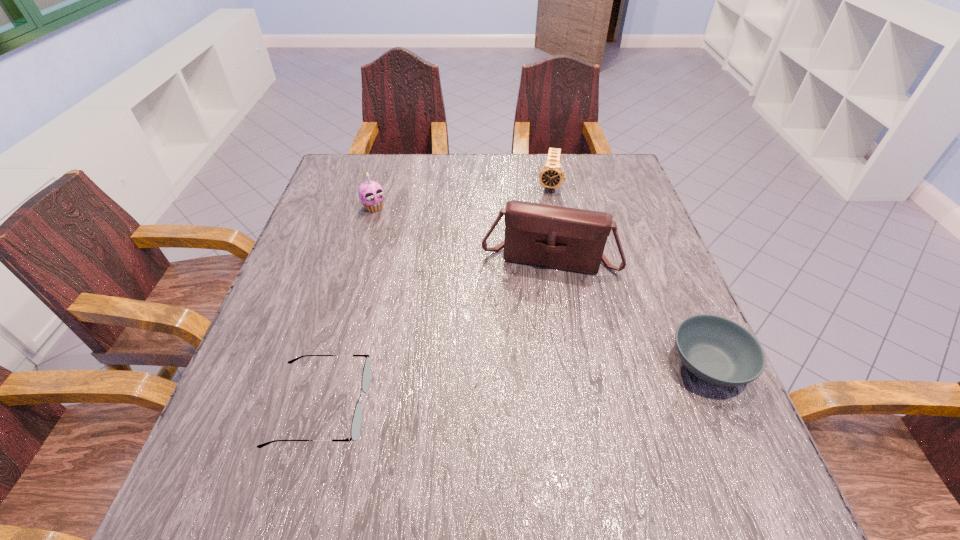
This screenshot has height=540, width=960. I want to click on the closest object to the third farthest object, so click(x=717, y=350).

Image resolution: width=960 pixels, height=540 pixels. In order to click on the closest object relative to the spectacles in this screenshot , I will do `click(564, 238)`.